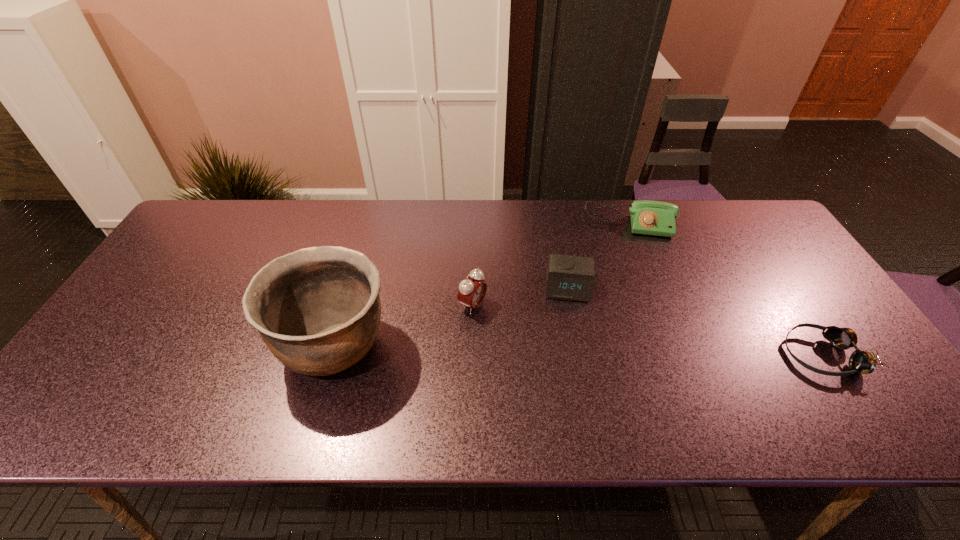
Locate an element on the screen. The image size is (960, 540). vacant space on the desktop that is between the pottery and the goggles and is positioned on the dial of the farthest object is located at coordinates (640, 352).

Image resolution: width=960 pixels, height=540 pixels. In order to click on free spot on the desktop that is between the pottery and the rightmost object and is positioned on the clock face of the taller alarm clock in this screenshot , I will do [x=564, y=350].

Find the location of a particular element. This screenshot has width=960, height=540. free space on the desktop that is between the pottery and the shortest object and is positioned on the front-facing side of the right alarm clock is located at coordinates point(568,350).